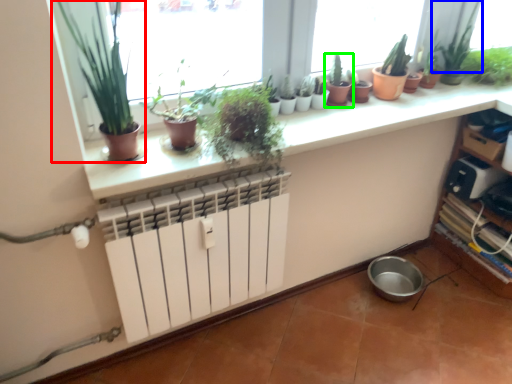
Question: Which is farther away from houseplant (highlighted by a red box)? plant (highlighted by a blue box) or houseplant (highlighted by a green box)?

Choices:
 (A) plant
 (B) houseplant

Answer: (A)